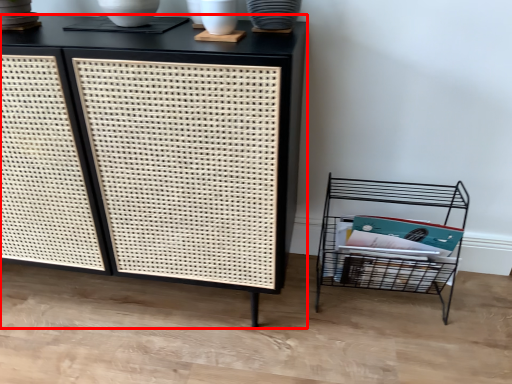
Question: Observing the image, what is the correct spatial positioning of furniture (annotated by the red box) in reference to shelf?

Choices:
 (A) right
 (B) left

Answer: (B)